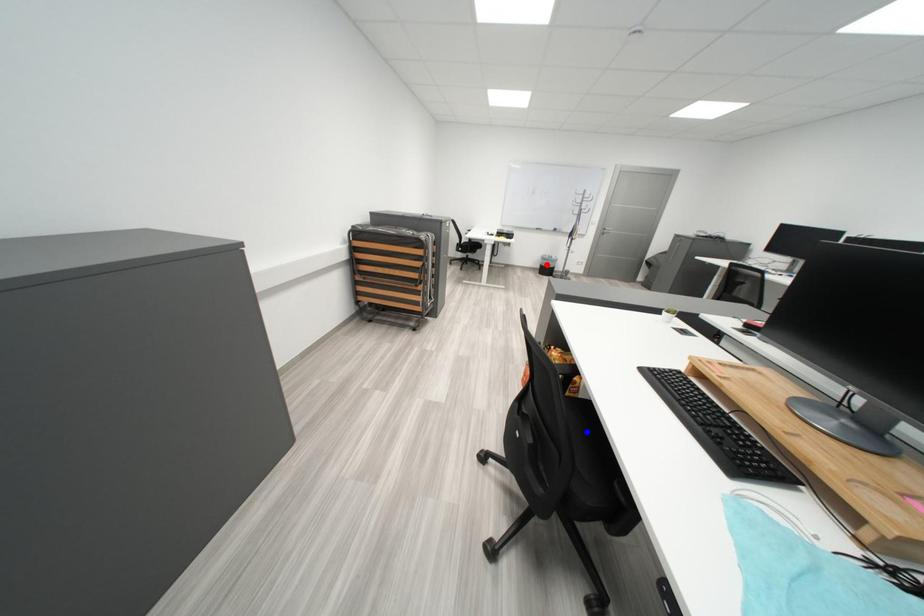
Question: In the image, two points are highlighted. Which point is nearer to the camera? Reply with the corresponding letter.

Choices:
 (A) blue point
 (B) red point

Answer: (A)